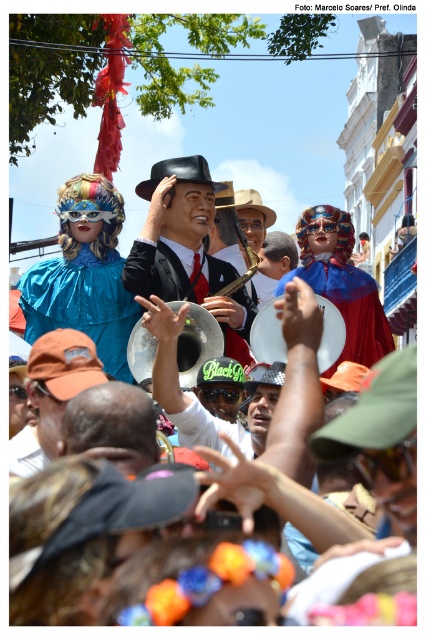
You are at a festival and see two hats in the crowd. The shiny black hat at center and the brown fabric cap at center. Which hat is taller?

The shiny black hat at center is taller than the brown fabric cap at center.

You are standing at the center of the street and want to locate the shiny red cape at center. Based on the coordinates provided, where should you look?

The shiny red cape at center is located at coordinates point 0.483 on the x axis and 0.822 on the y axis.

You are a photographer trying to capture a clear shot of both the shiny black hat at center and the shiny red cape at center in the vibrant street scene. Since you want to focus on the taller object, which one should you adjust your camera to focus on?

The shiny black hat at center is taller than the shiny red cape at center, so you should adjust your camera to focus on the shiny black hat at center.